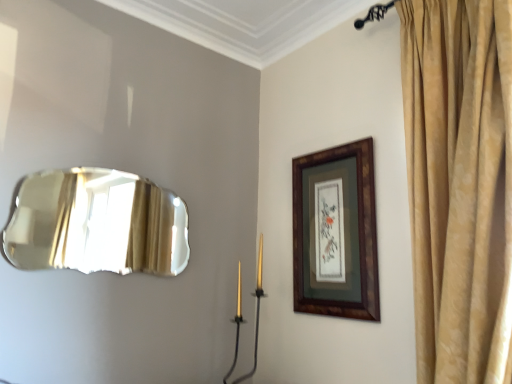
Question: From their relative heights in the image, would you say gold metallic candle holder at center is taller or shorter than gold velvet curtain at upper right?

Choices:
 (A) tall
 (B) short

Answer: (B)

Question: From the image's perspective, is gold metallic candle holder at center located above or below gold velvet curtain at upper right?

Choices:
 (A) below
 (B) above

Answer: (A)

Question: Which object is the closest to the shiny metallic mirror at left?

Choices:
 (A) wooden frame at upper right
 (B) gold metallic candle holder at center
 (C) gold velvet curtain at upper right

Answer: (B)

Question: Estimate the real-world distances between objects in this image. Which object is closer to the gold metallic candle holder at center?

Choices:
 (A) gold velvet curtain at upper right
 (B) shiny metallic mirror at left
 (C) wooden frame at upper right

Answer: (C)